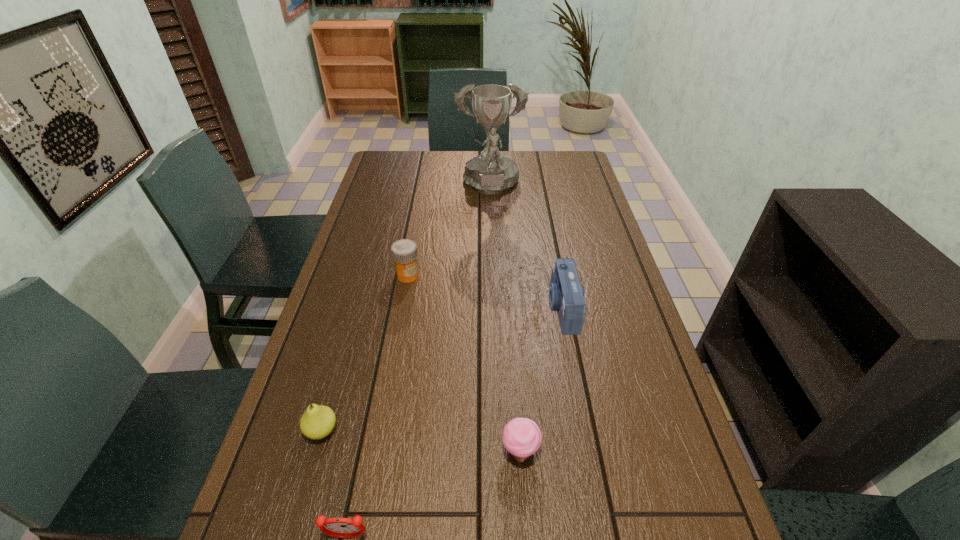
Identify the location of empty space that is in between the tallest object and the medicine. This screenshot has width=960, height=540. (449, 232).

The width and height of the screenshot is (960, 540). I want to click on free space between the pear and the medicine, so click(x=365, y=353).

The width and height of the screenshot is (960, 540). Identify the location of blank region between the cupcake and the pear. (421, 441).

Identify the location of vacant area that lies between the rightmost object and the cupcake. pos(541,380).

Find the location of a particular element. The width and height of the screenshot is (960, 540). vacant area that lies between the leftmost object and the cupcake is located at coordinates (421, 441).

You are a GUI agent. You are given a task and a screenshot of the screen. Output one action in this format:
    pyautogui.click(x=<x>, y=<y>)
    Task: Click on the third closest object to the cupcake
    The width and height of the screenshot is (960, 540).
    Given the screenshot: What is the action you would take?
    pyautogui.click(x=318, y=421)

Identify the location of object that is the fifth closest to the cupcake. (491, 172).

Locate an element on the screen. The width and height of the screenshot is (960, 540). vacant area in the image that satisfies the following two spatial constraints: 1. on the front side of the cupcake; 2. on the left side of the leftmost object is located at coordinates (316, 451).